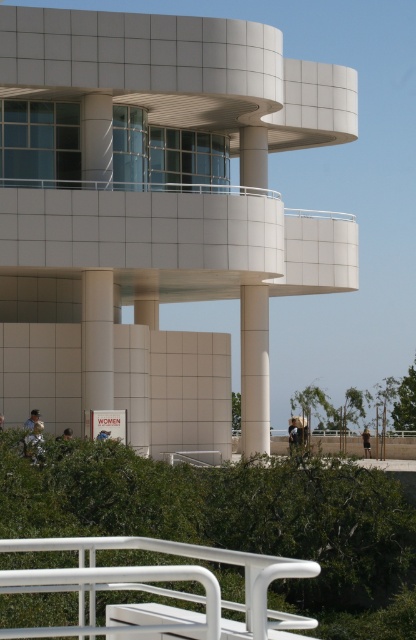
Based on the photo, who is taller, white matte rail at lower center or white smooth column at center?

With more height is white smooth column at center.

In order to click on white matte rail at lower center in this screenshot , I will do `click(160, 588)`.

Describe the element at coordinates (96, 342) in the screenshot. The height and width of the screenshot is (640, 416). I see `white smooth pillar at center` at that location.

Which is behind, point (106, 339) or point (368, 444)?

The point (368, 444) is more distant.

Which is behind, point (83, 403) or point (364, 429)?

Point (364, 429)

Where is `white smooth pillar at center`? Image resolution: width=416 pixels, height=640 pixels. white smooth pillar at center is located at coordinates (96, 342).

Does white smooth column at center appear under brown fabric shirt at center?

No, white smooth column at center is not below brown fabric shirt at center.

Is white smooth column at center closer to camera compared to brown fabric shirt at center?

Yes, it is in front of brown fabric shirt at center.

Locate an element on the screen. Image resolution: width=416 pixels, height=640 pixels. white smooth column at center is located at coordinates (255, 369).

Where is `white smooth column at center`? Image resolution: width=416 pixels, height=640 pixels. white smooth column at center is located at coordinates (255, 369).